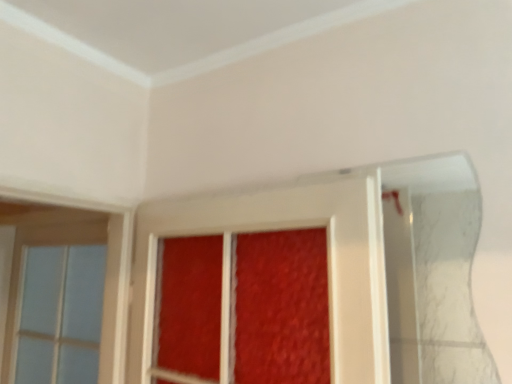
Image resolution: width=512 pixels, height=384 pixels. Describe the element at coordinates (61, 315) in the screenshot. I see `clear glass window at left` at that location.

You are a GUI agent. You are given a task and a screenshot of the screen. Output one action in this format:
    pyautogui.click(x=<x>, y=<y>)
    Task: Click on the clear glass window at left
    
    Given the screenshot: What is the action you would take?
    pyautogui.click(x=61, y=315)

Measure the distance between clear glass window at left and camera.

They are 5.47 feet apart.

This screenshot has width=512, height=384. In order to click on clear glass window at left in this screenshot , I will do `click(61, 315)`.